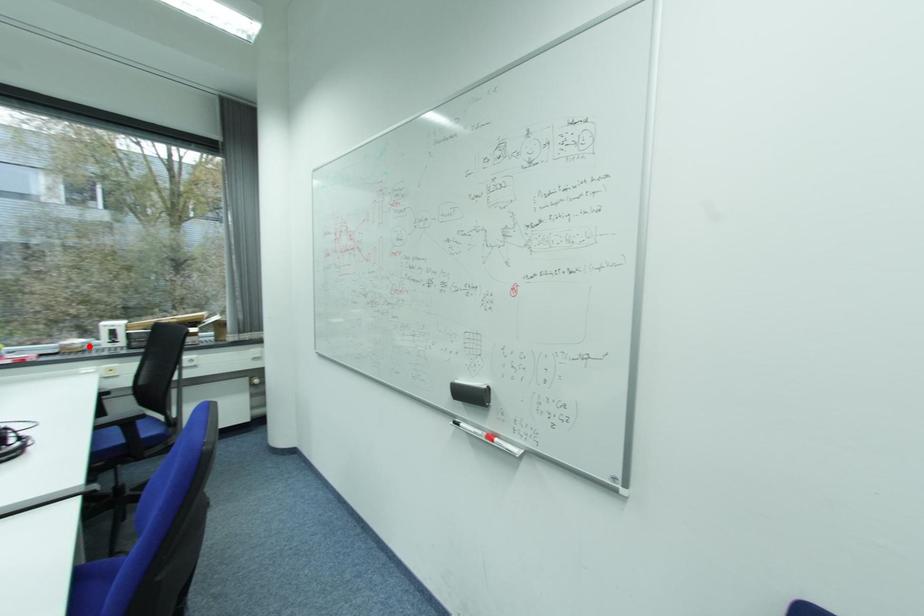
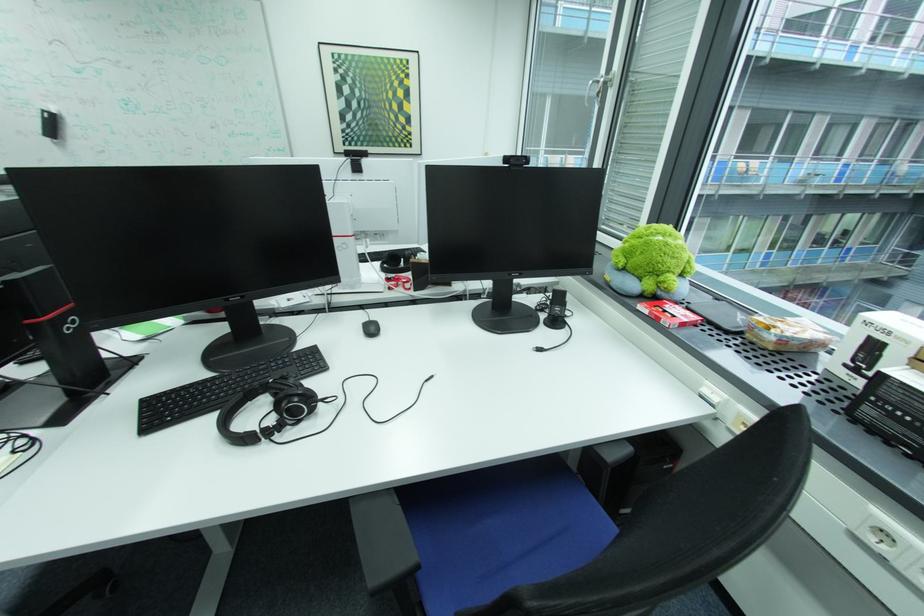
Where in the second image is the point corresponding to the highlighted location from the first image?

(781, 339)